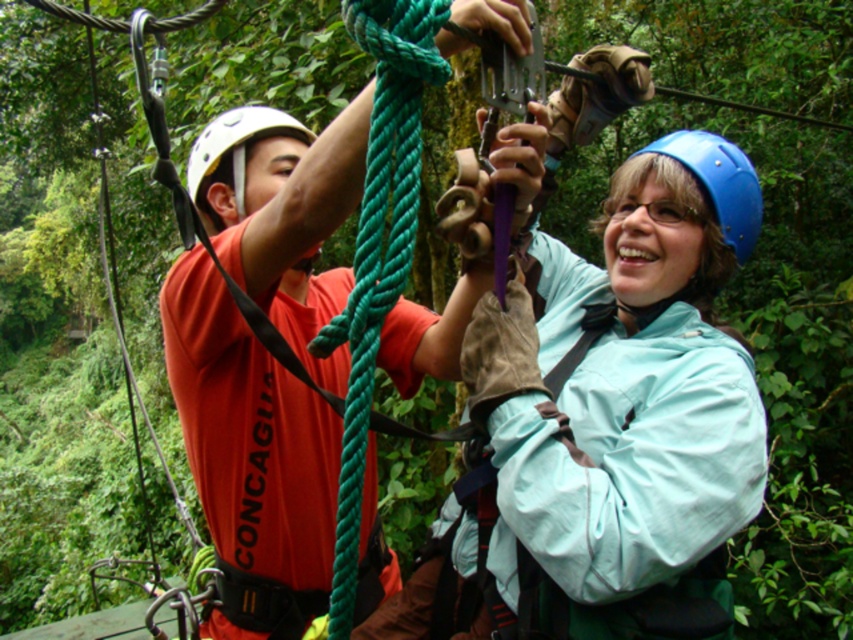
Question: Can you confirm if blue matte helmet at center is positioned to the right of white matte helmet at upper left?

Choices:
 (A) yes
 (B) no

Answer: (A)

Question: Does blue matte helmet at center appear on the right side of white matte helmet at upper left?

Choices:
 (A) yes
 (B) no

Answer: (A)

Question: Which point is farther from the camera taking this photo?

Choices:
 (A) (235, 170)
 (B) (744, 252)

Answer: (A)

Question: Which of the following is the closest to the observer?

Choices:
 (A) blue matte helmet at center
 (B) white matte helmet at upper left

Answer: (A)

Question: Which point appears closest to the camera in this image?

Choices:
 (A) (236, 182)
 (B) (750, 241)

Answer: (B)

Question: Is blue matte helmet at center positioned behind white matte helmet at upper left?

Choices:
 (A) no
 (B) yes

Answer: (A)